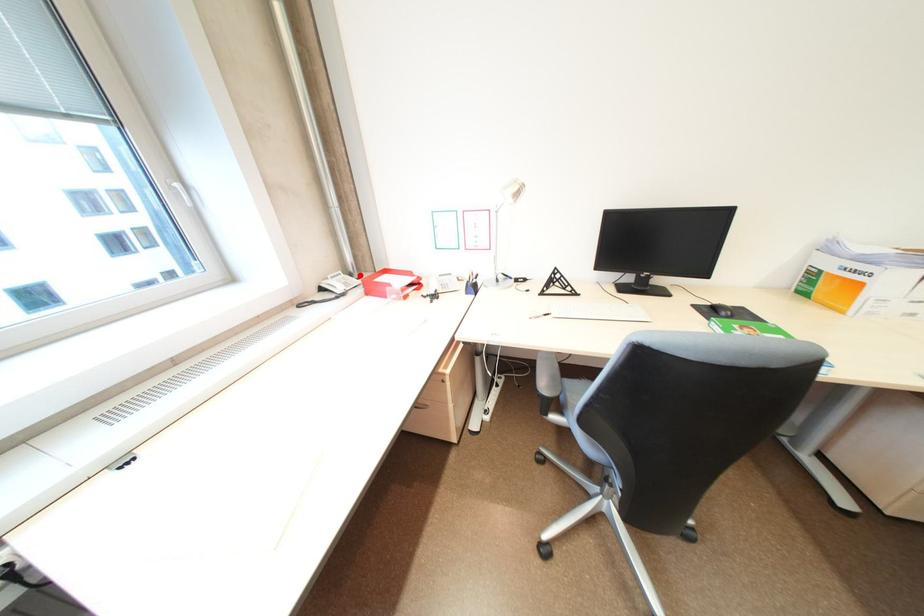
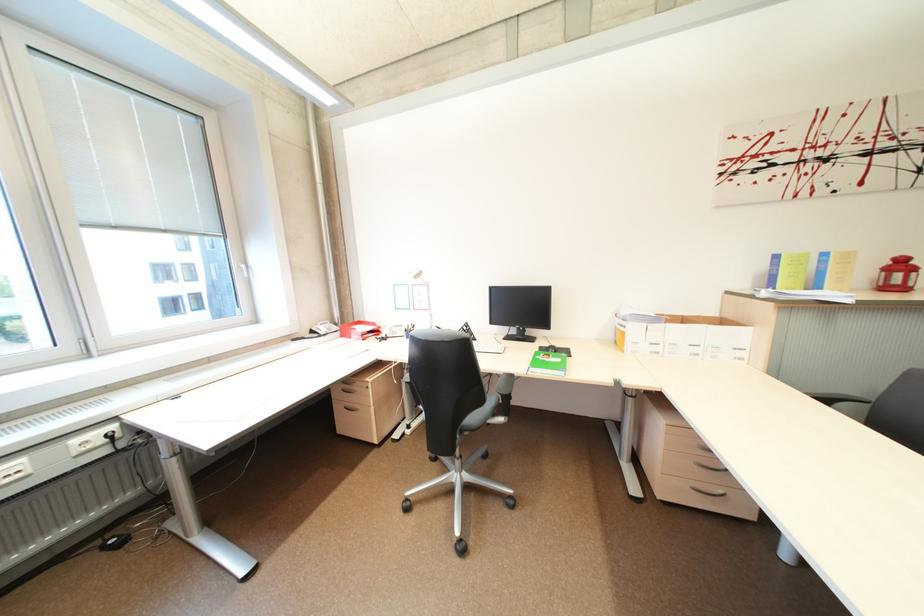
Find the pixel in the second image that matches the highlighted location in the first image.

(345, 325)